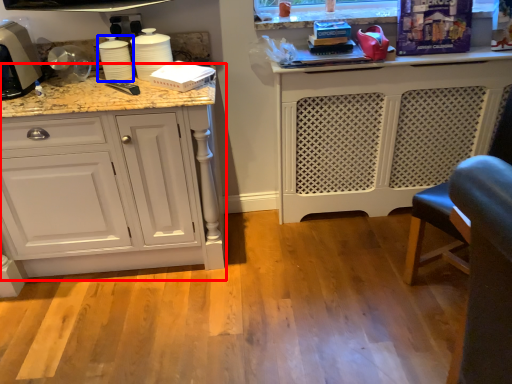
Question: Which of the following is the closest to the observer, cabinetry (highlighted by a red box) or appliance (highlighted by a blue box)?

Choices:
 (A) cabinetry
 (B) appliance

Answer: (A)